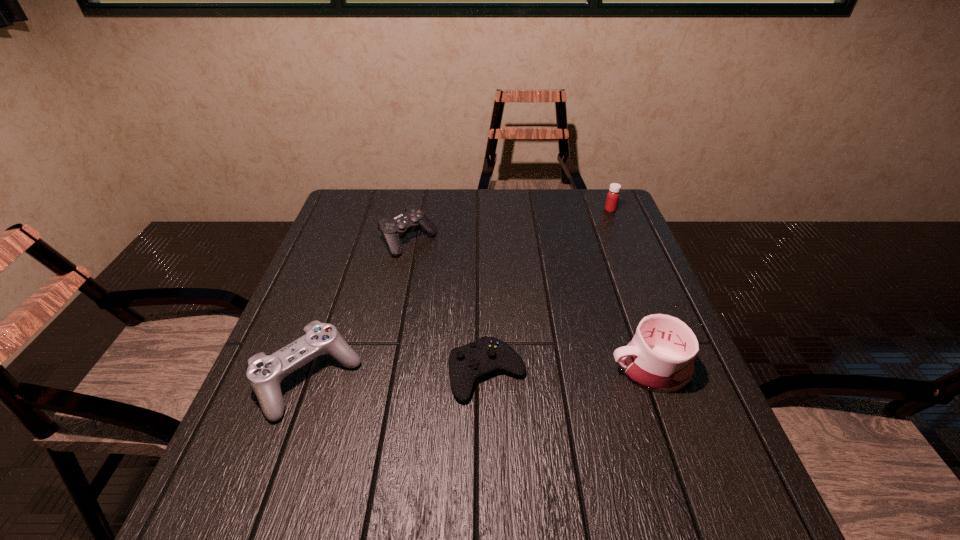
Image resolution: width=960 pixels, height=540 pixels. Find the location of `free space located 0.270m on the back of the shortest control`. free space located 0.270m on the back of the shortest control is located at coordinates (486, 269).

In order to click on medicine situated at the far edge in this screenshot , I will do `click(613, 195)`.

Locate an element on the screen. control located in the far edge section of the desktop is located at coordinates coord(413,218).

Image resolution: width=960 pixels, height=540 pixels. In order to click on object located at the left edge in this screenshot , I will do `click(265, 373)`.

Locate an element on the screen. mug that is at the right edge is located at coordinates (660, 357).

Locate an element on the screen. The height and width of the screenshot is (540, 960). medicine at the right edge is located at coordinates (613, 195).

At what (x,y) coordinates should I click in order to perform the action: click on object located in the far right corner section of the desktop. Please return your answer as a coordinate pair (x, y). Looking at the image, I should click on (613, 195).

Locate an element on the screen. Image resolution: width=960 pixels, height=540 pixels. free region at the far edge is located at coordinates (567, 214).

In the image, there is a desktop. At what (x,y) coordinates should I click in order to perform the action: click on blank space at the near edge. Please return your answer as a coordinate pair (x, y). This screenshot has height=540, width=960. Looking at the image, I should click on (396, 509).

This screenshot has height=540, width=960. I want to click on vacant space at the left edge of the desktop, so click(x=277, y=421).